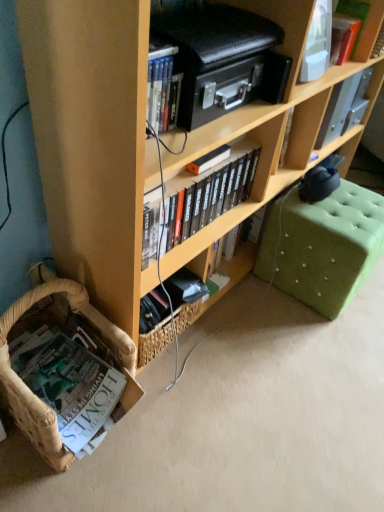
Locate an element on the screen. Image resolution: width=384 pixels, height=512 pixels. vacant area on top of green tufted ottoman at lower right (from a real-world perspective) is located at coordinates pyautogui.click(x=352, y=205).